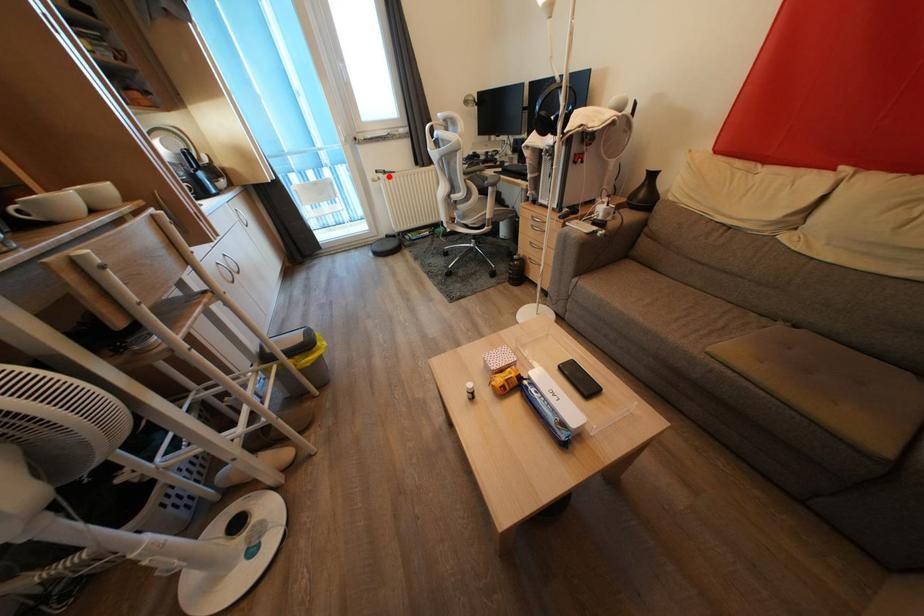
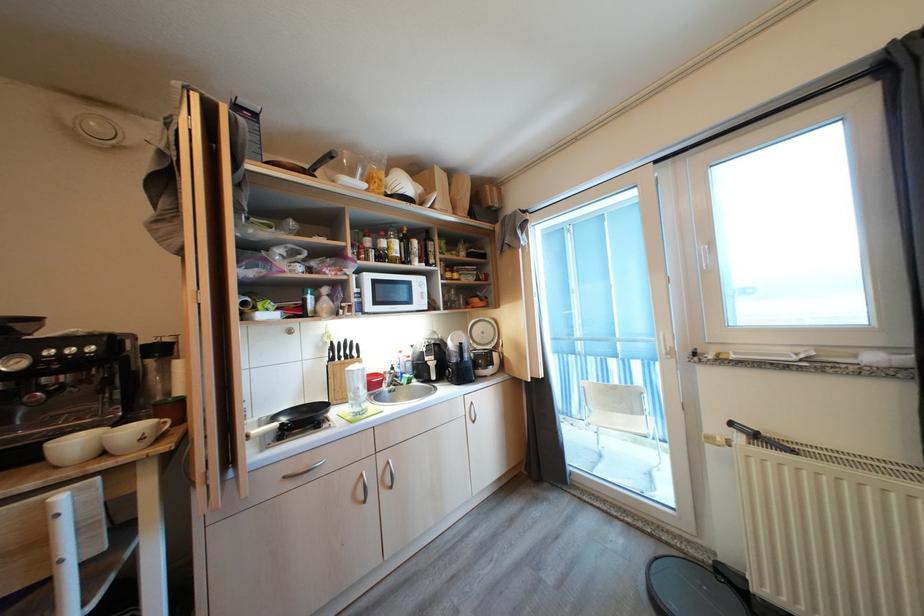
Question: I am providing you with two images of the same scene from different viewpoints. A red point is shown in image1. For the corresponding object point in image2, is it positioned nearer or farther from the camera?

Choices:
 (A) Nearer
 (B) Farther

Answer: (B)